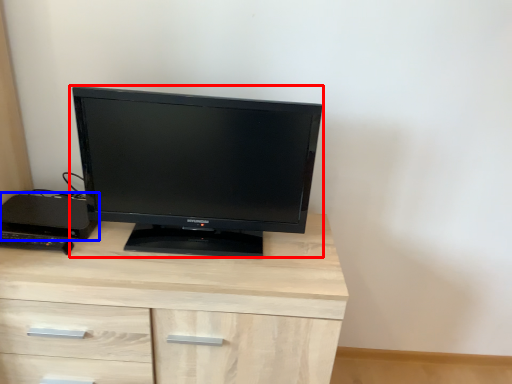
Question: Which point is closer to the camera, computer monitor (highlighted by a red box) or desktop (highlighted by a blue box)?

Choices:
 (A) computer monitor
 (B) desktop

Answer: (A)